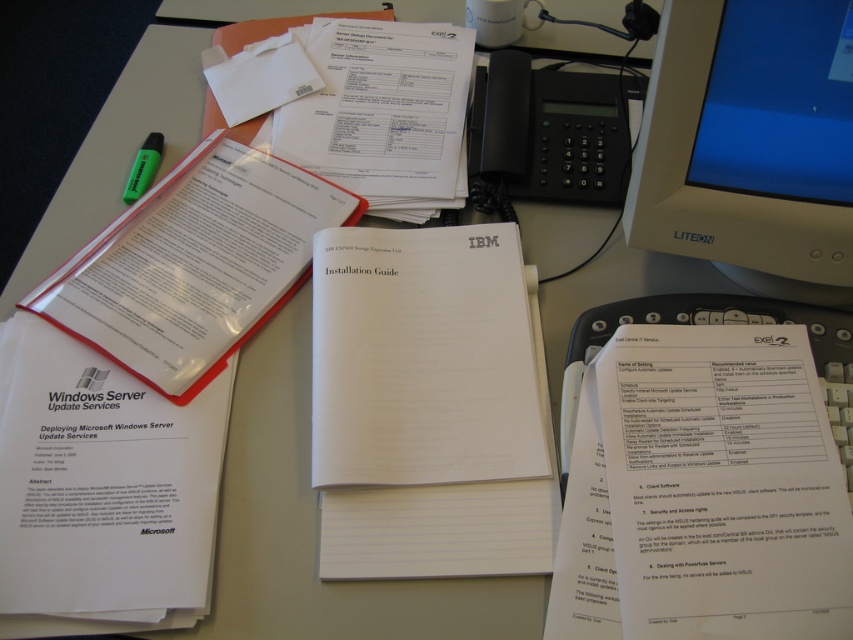
Who is taller, white paper at center or white paper at lower left?

white paper at lower left is taller.

Who is more forward, (685, 616) or (62, 563)?

Point (685, 616) is in front.

Between point (730, 340) and point (175, 436), which one is positioned in front?

Point (175, 436) is more forward.

Find the location of `white paper at center`. white paper at center is located at coordinates (723, 484).

The height and width of the screenshot is (640, 853). What do you see at coordinates (723, 484) in the screenshot?
I see `white paper at center` at bounding box center [723, 484].

Which is behind, point (677, 381) or point (154, 147)?

The point (154, 147) is behind.

Where is `white paper at center`? The width and height of the screenshot is (853, 640). white paper at center is located at coordinates (723, 484).

Is the position of white paper notepad at center less distant than that of black plastic keyboard at center-right?

That is True.

Can you confirm if white paper notepad at center is bigger than black plastic keyboard at center-right?

Yes.

Which is in front, point (535, 289) or point (840, 376)?

Point (840, 376) is more forward.

Find the location of a particular element. The width and height of the screenshot is (853, 640). white paper notepad at center is located at coordinates (428, 404).